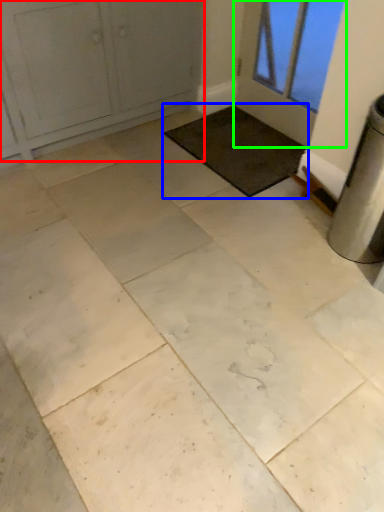
Question: Which is nearer to the door (highlighted by a red box)? mat (highlighted by a blue box) or door (highlighted by a green box).

Choices:
 (A) mat
 (B) door

Answer: (A)